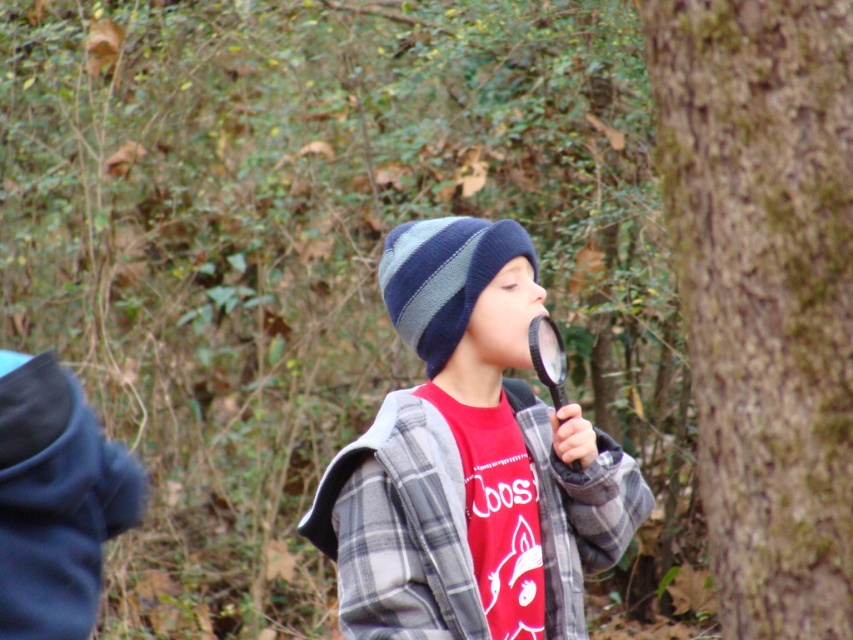
Is striped knit beanie at center thinner than black plastic magnifying glass at center?

No, striped knit beanie at center is not thinner than black plastic magnifying glass at center.

Where is `striped knit beanie at center`? This screenshot has height=640, width=853. striped knit beanie at center is located at coordinates (444, 276).

Can you confirm if knit wool beanie at center is taller than black plastic magnifying glass at center?

Yes.

Does knit wool beanie at center have a lesser height compared to black plastic magnifying glass at center?

No.

Who is more forward, (425, 573) or (537, 358)?

Point (425, 573) is in front.

Where is `knit wool beanie at center`? knit wool beanie at center is located at coordinates (469, 461).

The height and width of the screenshot is (640, 853). Describe the element at coordinates (764, 291) in the screenshot. I see `brown rough bark at right` at that location.

The image size is (853, 640). In order to click on brown rough bark at right in this screenshot , I will do `click(764, 291)`.

The image size is (853, 640). Find the location of `brown rough bark at right`. brown rough bark at right is located at coordinates (764, 291).